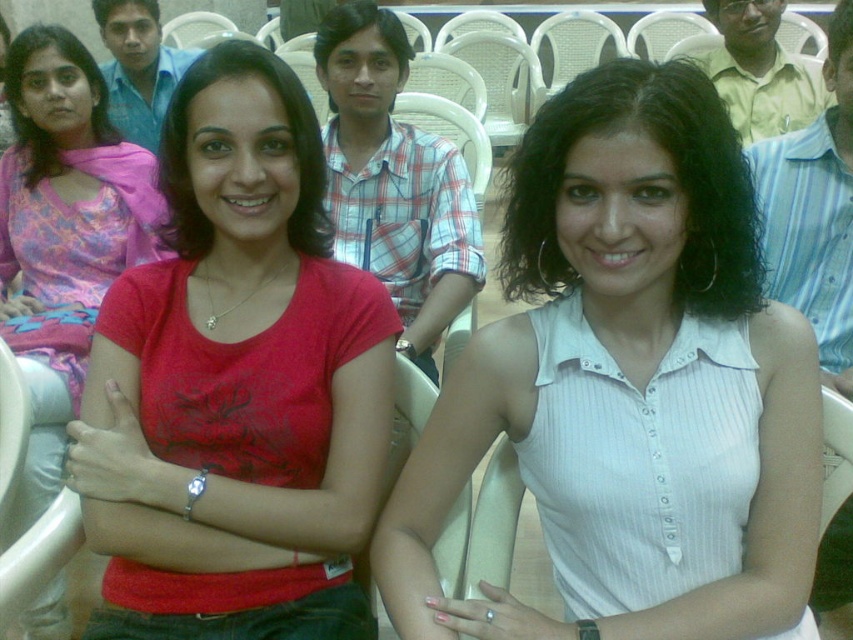
Question: Which of the following is the farthest from the observer?

Choices:
 (A) white ribbed shirt at center
 (B) matte red t-shirt at center
 (C) white striped shirt at right

Answer: (C)

Question: Can you confirm if white ribbed shirt at center is positioned to the right of matte red shirt at center?

Choices:
 (A) yes
 (B) no

Answer: (A)

Question: Can you confirm if matte red t-shirt at center is positioned above matte red shirt at center?

Choices:
 (A) yes
 (B) no

Answer: (B)

Question: Which of these objects is positioned closest to the matte red shirt at center?

Choices:
 (A) white striped blouse at center
 (B) white striped shirt at right
 (C) matte red t-shirt at center

Answer: (C)

Question: Which point is farther to the camera?

Choices:
 (A) (402, 268)
 (B) (88, 298)

Answer: (A)

Question: Does plaid cotton shirt at center have a greater width compared to white striped shirt at right?

Choices:
 (A) yes
 (B) no

Answer: (A)